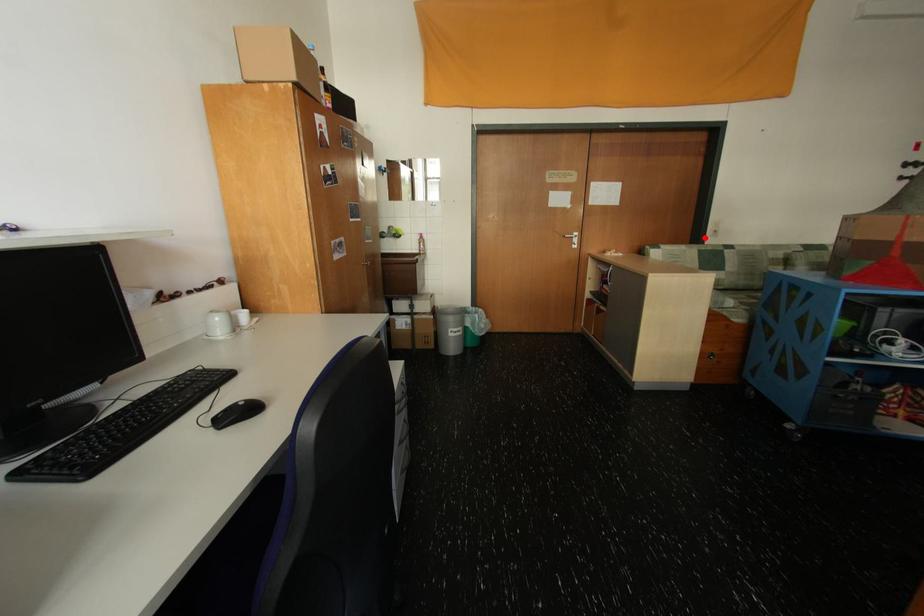
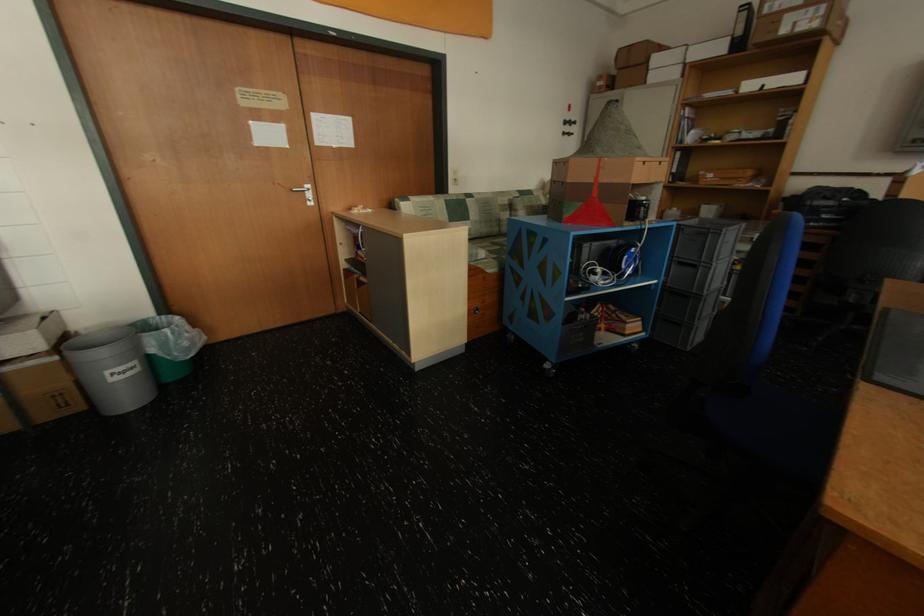
The point at the highlighted location is marked in the first image. Where is the corresponding point in the second image?

(448, 187)